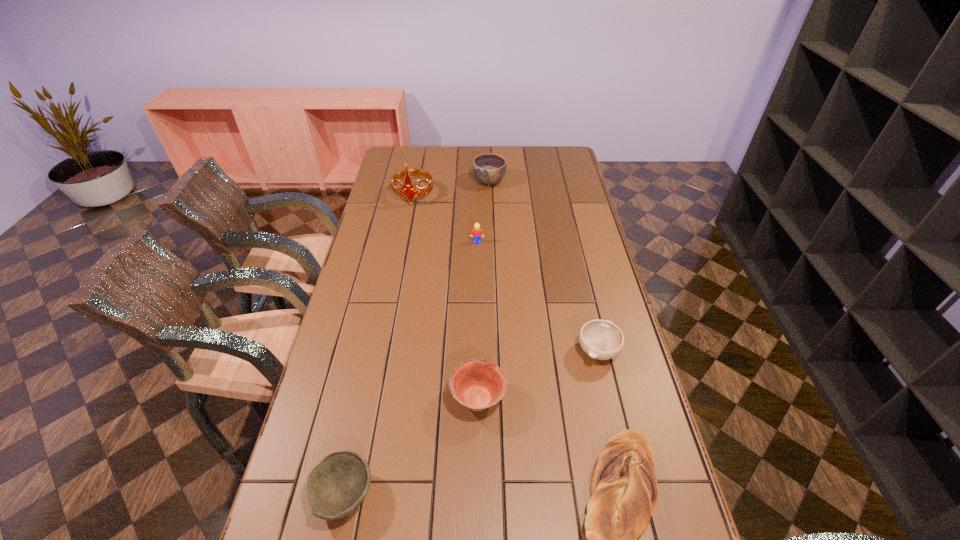
In order to click on blank space at the far left corner in this screenshot , I will do `click(399, 155)`.

Find the location of a particular element. The width and height of the screenshot is (960, 540). empty location between the farthest bowl and the nearest bowl is located at coordinates (417, 338).

Identify the location of vacant area between the tiara and the fifth nearest object. Image resolution: width=960 pixels, height=540 pixels. (445, 219).

Find the location of a particular element. free space that is in between the fifth farthest object and the fifth nearest object is located at coordinates (478, 320).

At what (x,y) coordinates should I click in order to perform the action: click on blank region between the sixth shortest object and the leftmost bowl. Please return your answer as a coordinate pair (x, y). The height and width of the screenshot is (540, 960). Looking at the image, I should click on (417, 338).

Locate an element on the screen. This screenshot has width=960, height=540. vacant point located between the tallest bowl and the tallest object is located at coordinates (451, 188).

Find the location of a particular element. The width and height of the screenshot is (960, 540). free spot between the third farthest object and the farthest bowl is located at coordinates (483, 212).

Locate an element on the screen. This screenshot has width=960, height=540. object that is the sixth closest to the rightmost bowl is located at coordinates (409, 191).

Identify which object is located as the third nearest to the fifth nearest object. Please provide its 2D coordinates. Your answer should be formatted as a tuple, i.e. [(x, y)], where the tuple contains the x and y coordinates of a point satisfying the conditions above.

[(600, 339)]

Identify the location of bowl that is the second closest to the rightmost bowl. The height and width of the screenshot is (540, 960). (335, 487).